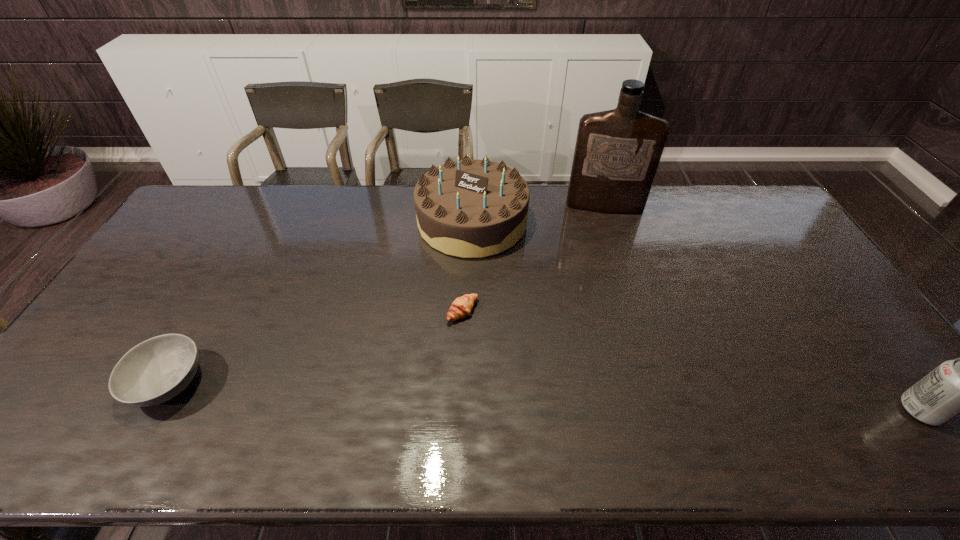
Identify the location of vacant space on the desktop that is between the leftmost object and the soda can and is positioned on the label side of the tallest object. This screenshot has height=540, width=960. (616, 399).

Locate an element on the screen. This screenshot has height=540, width=960. vacant space on the desktop that is between the second shortest object and the rightmost object and is positioned on the front-facing side of the third nearest object is located at coordinates (592, 398).

This screenshot has height=540, width=960. I want to click on free space on the desktop that is between the leftmost object and the third shortest object and is positioned on the front-facing side of the fourth shortest object, so click(427, 392).